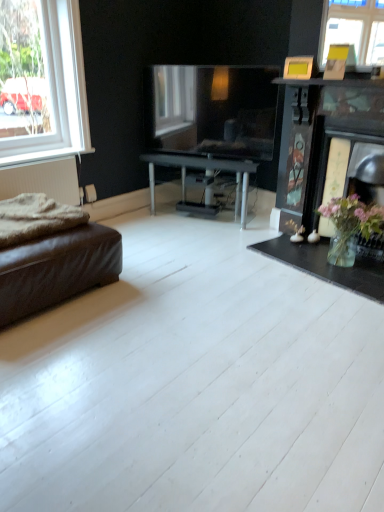
Question: In the image, is brown leather studio couch at lower left on the left side or the right side of clear glass vase at lower right?

Choices:
 (A) left
 (B) right

Answer: (A)

Question: From a real-world perspective, is brown leather studio couch at lower left physically located above or below clear glass vase at lower right?

Choices:
 (A) below
 (B) above

Answer: (B)

Question: Which object is the farthest from the beige woolen blanket at lower left?

Choices:
 (A) clear glass vase at lower right
 (B) brown leather studio couch at lower left
 (C) white plastic window at upper left

Answer: (A)

Question: Considering the real-world distances, which object is closest to the clear glass vase at lower right?

Choices:
 (A) brown leather studio couch at lower left
 (B) white plastic window at upper left
 (C) beige woolen blanket at lower left

Answer: (A)